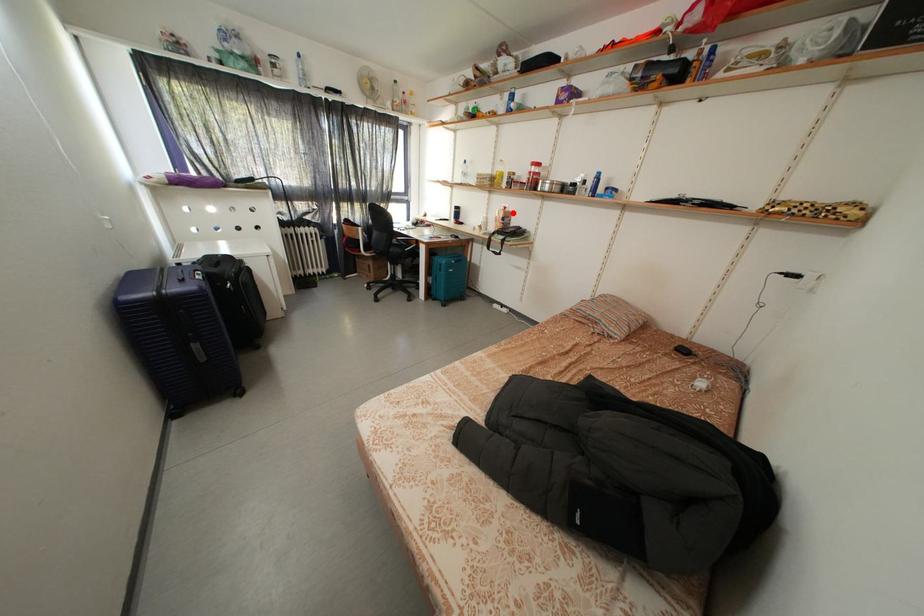
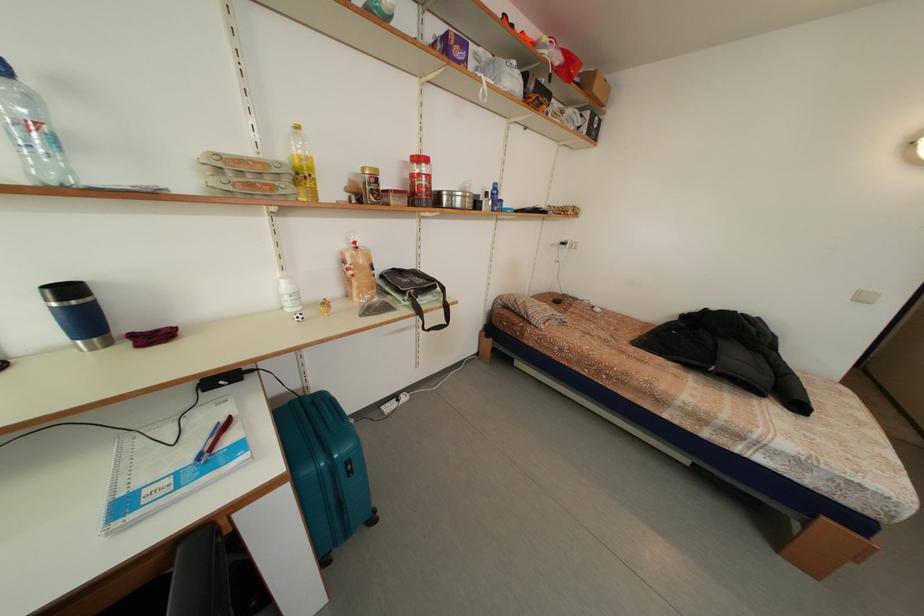
Where in the second image is the point corresponding to the highlighted location from the first image?

(362, 248)